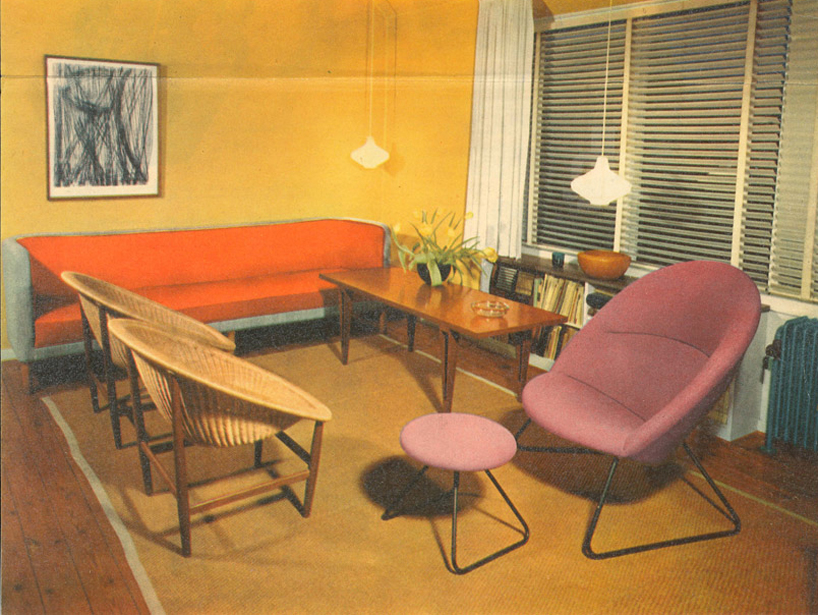
At what (x,y) coordinates should I click in order to perform the action: click on floor heater. Please return your answer as a coordinate pair (x, y). The width and height of the screenshot is (818, 615). Looking at the image, I should click on (801, 394).